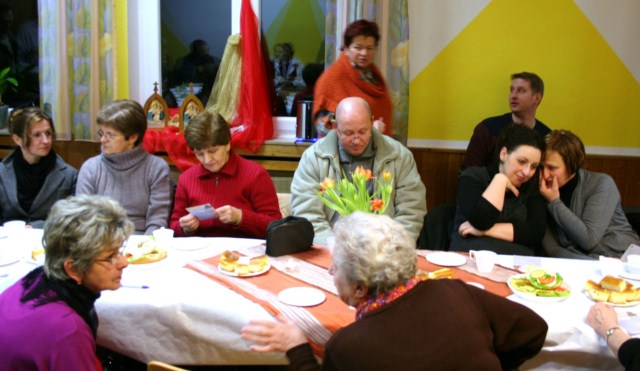
Locate an element on the screen. yellow shape on back wall is located at coordinates (577, 74).